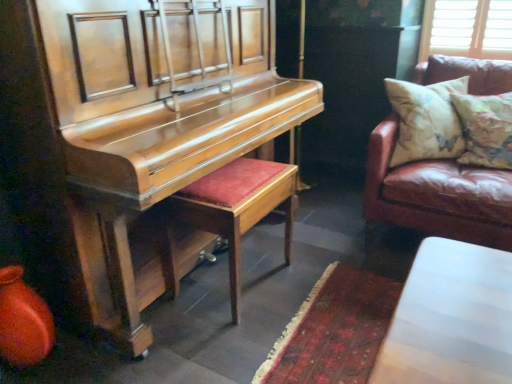
Find the location of a particular element. The image size is (512, 384). vacant space in front of velvet red stool at center is located at coordinates (223, 341).